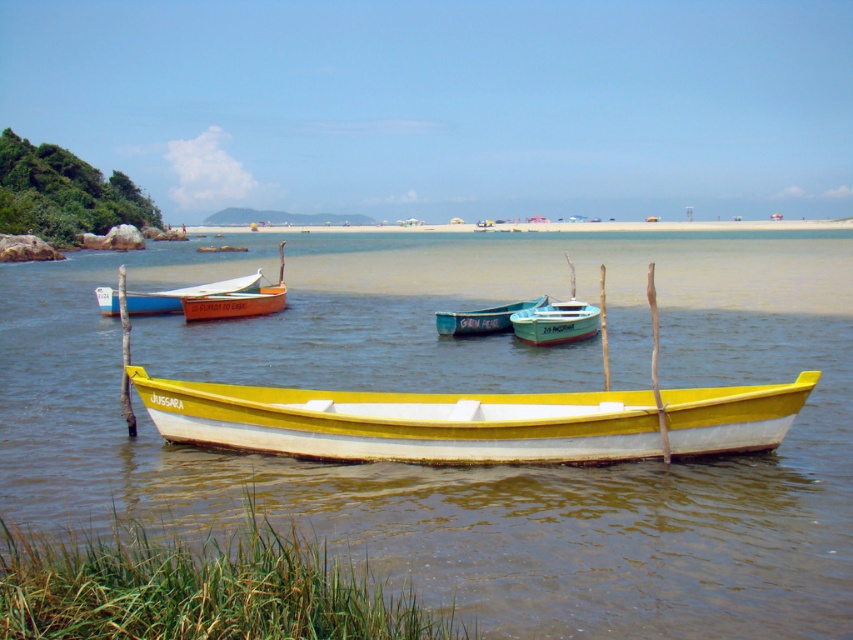
You are planning to take a boat ride on the calm water. You see two canoes available, the matte white canoe at center and the orange wood canoe at center. Which one would you choose if you want a larger boat?

The matte white canoe at center is bigger than the orange wood canoe at center, so you should choose the matte white canoe at center for a larger boat.

You are a photographer trying to capture the yellow matte water at center and the orange wood canoe at center in a single shot. Based on their sizes, which object will appear bigger in your photo?

The yellow matte water at center will appear bigger in the photo because it has a larger size compared to the orange wood canoe at center.

You are standing on the beach looking at the coastal scene. There are two points marked in the image, one at coordinate point (666, 364) and the other at point (265, 292). Which point is nearer to you as you stand on the beach?

Point (666, 364) is closer to the camera than point (265, 292), so the point at (666, 364) is nearer to you as you stand on the beach.